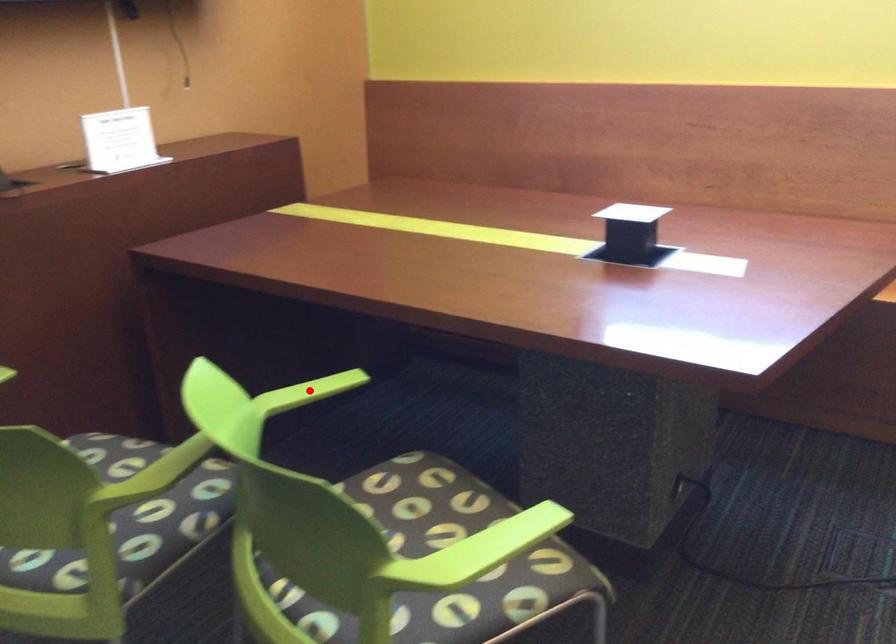
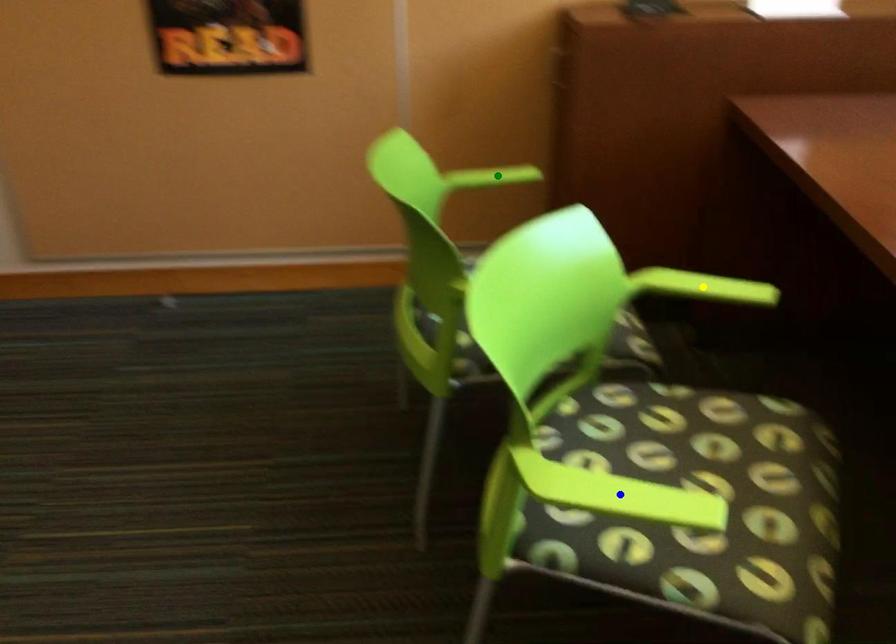
Question: I am providing you with two images of the same scene from different viewpoints. A red point is marked on the first image. You are given multiple points on the second image. Which spot in image 2 lines up with the point in image 1?

Choices:
 (A) yellow point
 (B) blue point
 (C) green point

Answer: (A)